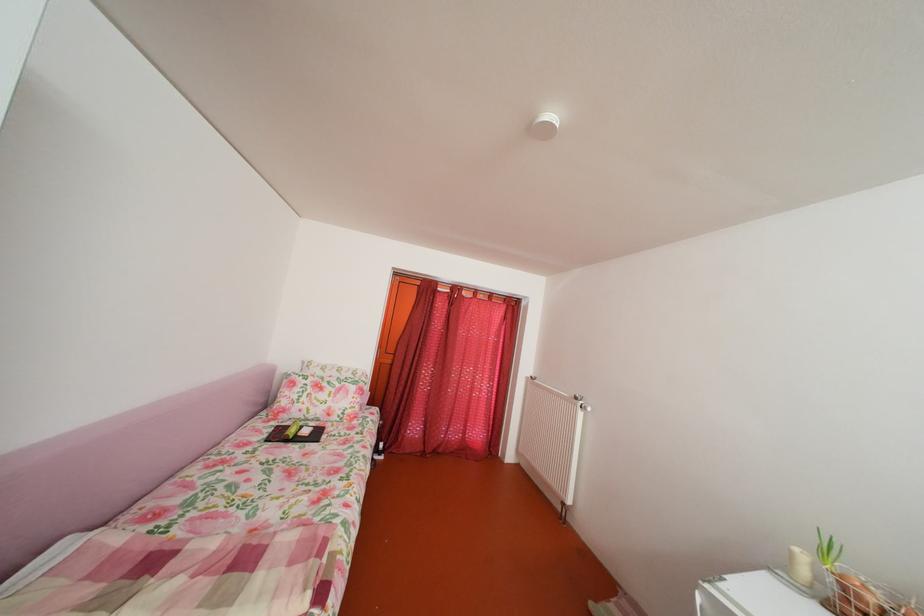
Locate an element on the screen. This screenshot has height=616, width=924. small green box is located at coordinates (284, 432).